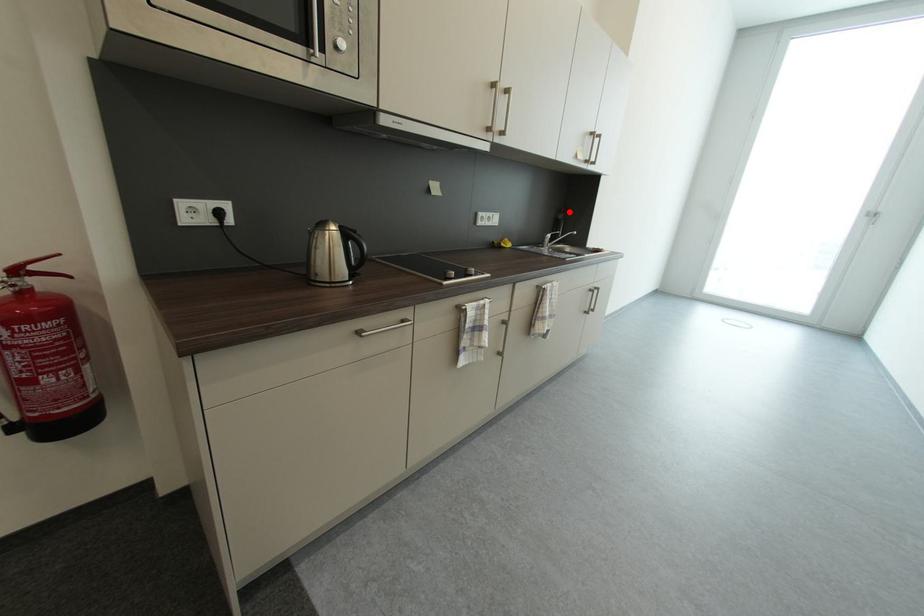
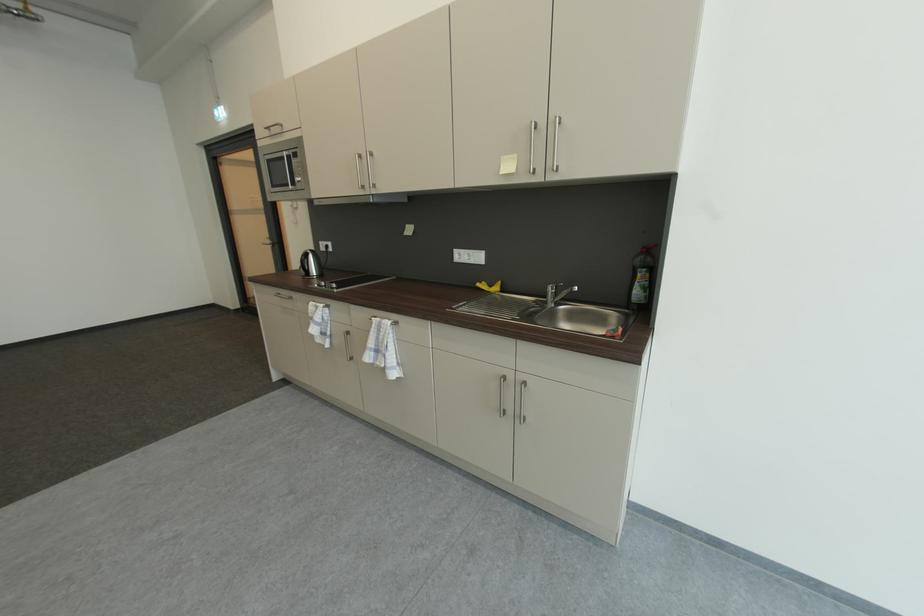
Question: I am providing you with two images of the same scene from different viewpoints. A red point is shown in image1. For the corresponding object point in image2, is it positioned nearer or farther from the camera?

Choices:
 (A) Nearer
 (B) Farther

Answer: (B)